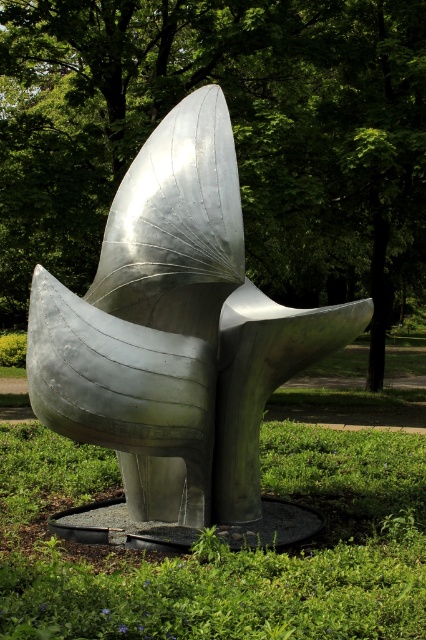
Question: Can you confirm if polished metal sculpture at center is thinner than green grass at center?

Choices:
 (A) no
 (B) yes

Answer: (B)

Question: Which point is closer to the camera?

Choices:
 (A) green leafy tree at center
 (B) polished metal sculpture at center

Answer: (B)

Question: Which of the following is the farthest from the observer?

Choices:
 (A) (2, 259)
 (B) (160, 225)

Answer: (A)

Question: Observing the image, what is the correct spatial positioning of green leafy tree at center in reference to polished metal sculpture at center?

Choices:
 (A) below
 (B) above

Answer: (B)

Question: Can you confirm if green leafy tree at center is wider than green grass at center?

Choices:
 (A) yes
 (B) no

Answer: (A)

Question: Which of the following is the farthest from the observer?

Choices:
 (A) (149, 29)
 (B) (302, 618)

Answer: (A)